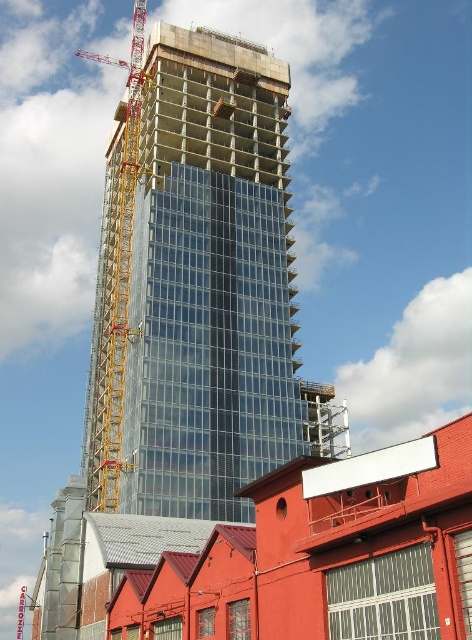
Looking at this image, is transparent glass building at center closer to camera compared to yellow metallic crane at left?

Yes, it is.

Who is positioned more to the right, transparent glass building at center or yellow metallic crane at left?

Positioned to the right is transparent glass building at center.

Which is behind, point (142, 273) or point (107, 400)?

The point (107, 400) is behind.

Locate an element on the screen. This screenshot has width=472, height=640. transparent glass building at center is located at coordinates (209, 282).